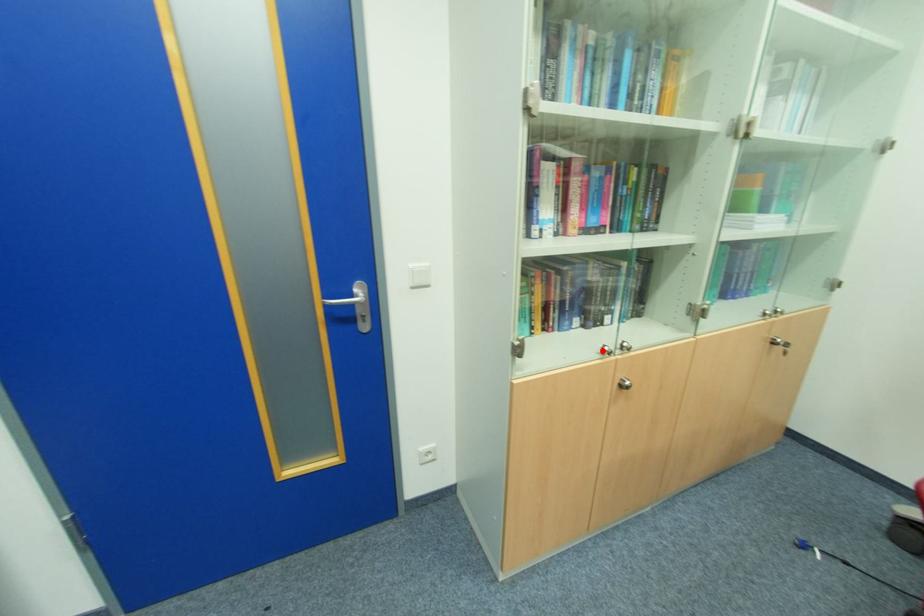
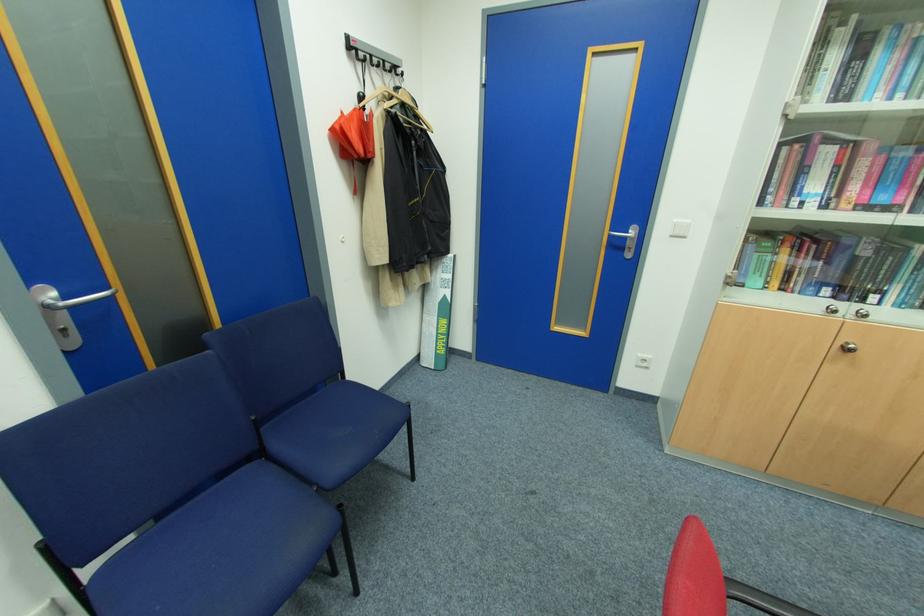
Question: I am providing you with two images of the same scene from different viewpoints. A red point is marked on the first image. At the location where the point appears in image 1, is it still visible in image 2?

Choices:
 (A) Yes
 (B) No

Answer: (A)